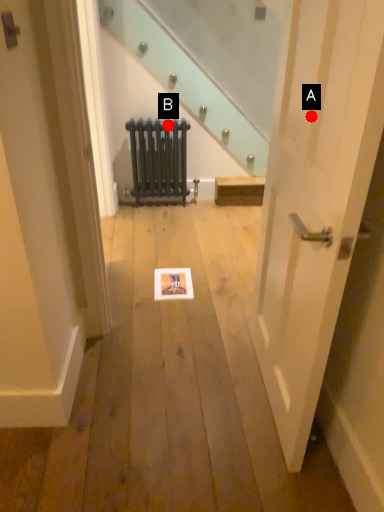
Question: Two points are circled on the image, labeled by A and B beside each circle. Among these points, which one is nearest to the camera?

Choices:
 (A) A is closer
 (B) B is closer

Answer: (A)